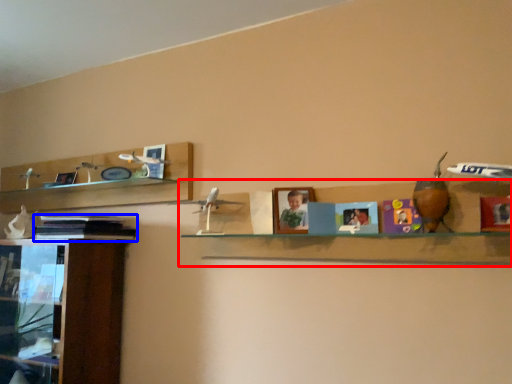
Question: Among these objects, which one is farthest to the camera, shelf (highlighted by a red box) or book (highlighted by a blue box)?

Choices:
 (A) shelf
 (B) book

Answer: (B)